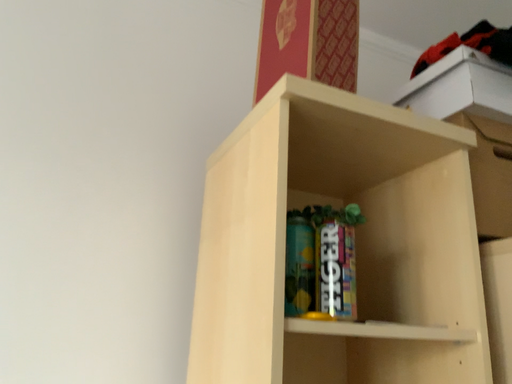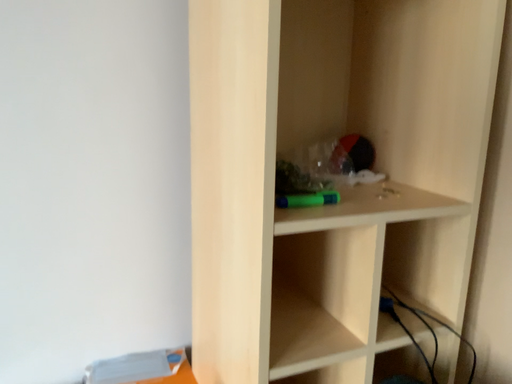
Question: Which way did the camera rotate in the video?

Choices:
 (A) rotated upward
 (B) rotated downward

Answer: (B)